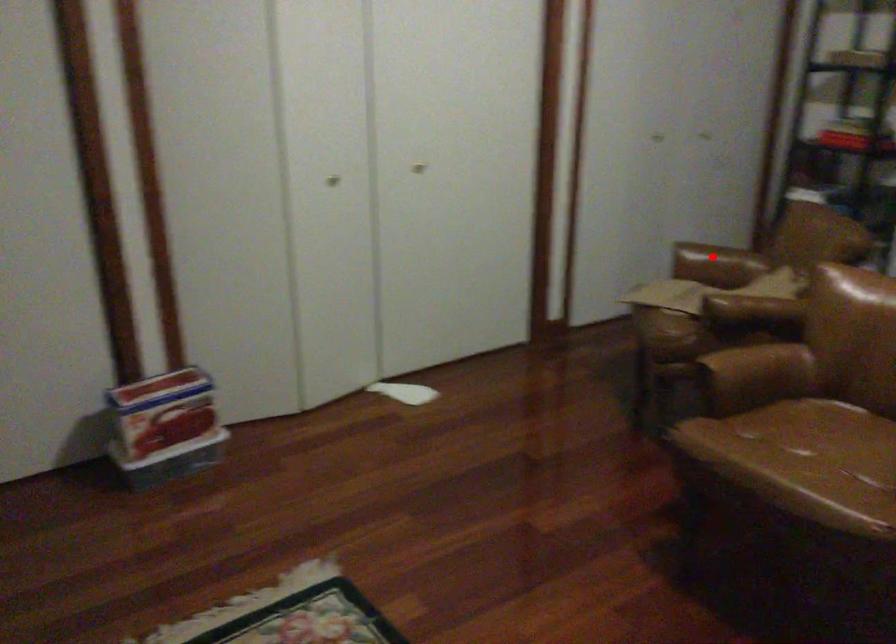
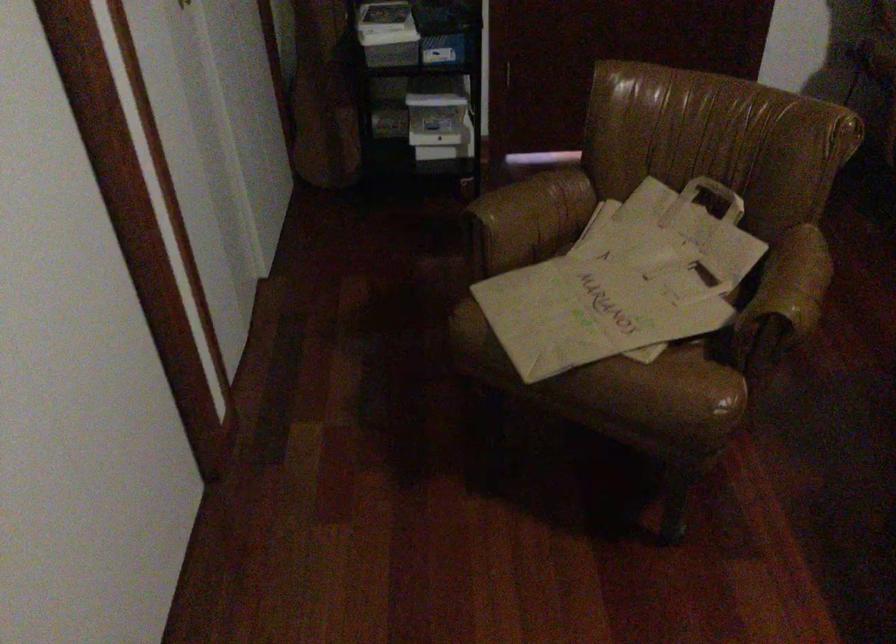
Question: I am providing you with two images of the same scene from different viewpoints. In image1, a red point is highlighted. Considering the same 3D point in image2, which of the following is correct?

Choices:
 (A) It is closer
 (B) It is farther

Answer: (A)